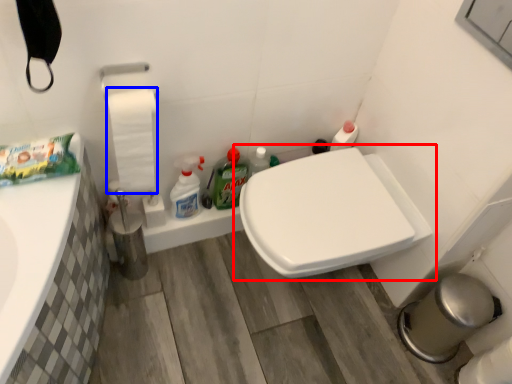
Question: Which of the following is the closest to the observer, toilet (highlighted by a red box) or toilet paper (highlighted by a blue box)?

Choices:
 (A) toilet
 (B) toilet paper

Answer: (B)